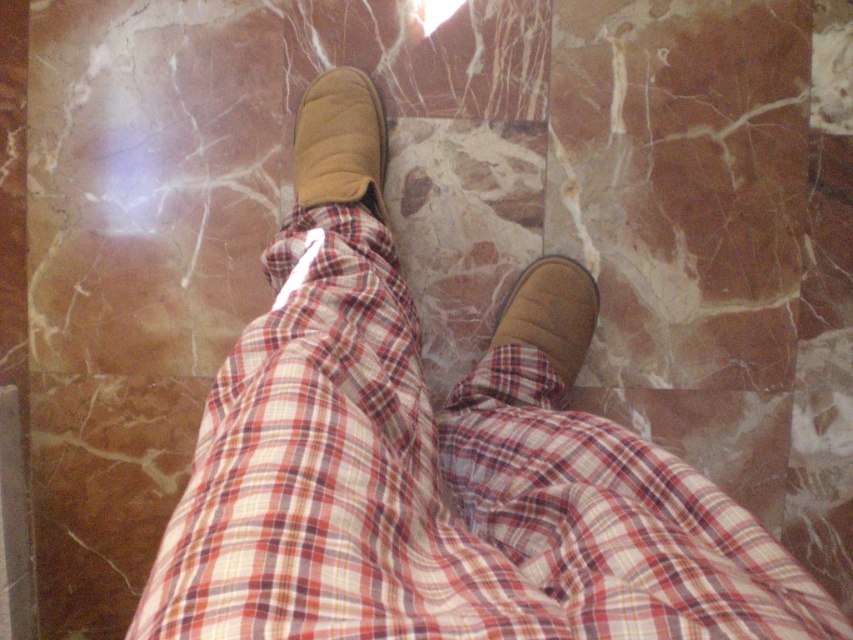
Can you confirm if plaid fabric at center is wider than brown suede slipper at lower right?

Yes.

Can you confirm if plaid fabric at center is positioned above brown suede slipper at lower right?

Actually, plaid fabric at center is below brown suede slipper at lower right.

Is point (206, 620) farther from viewer compared to point (558, 396)?

No, (206, 620) is in front of (558, 396).

This screenshot has width=853, height=640. I want to click on plaid fabric at center, so click(439, 490).

Describe the element at coordinates (439, 490) in the screenshot. I see `plaid fabric at center` at that location.

Is point (572, 492) behind point (366, 132)?

No, (572, 492) is in front of (366, 132).

The height and width of the screenshot is (640, 853). Identify the location of plaid fabric at center. (439, 490).

Locate an element on the screen. brown suede boot at center is located at coordinates (340, 141).

Which is in front, point (320, 188) or point (520, 285)?

Positioned in front is point (320, 188).

Based on the photo, who is more distant from viewer, [331,140] or [540,344]?

Positioned behind is point [331,140].

I want to click on brown suede boot at center, so click(340, 141).